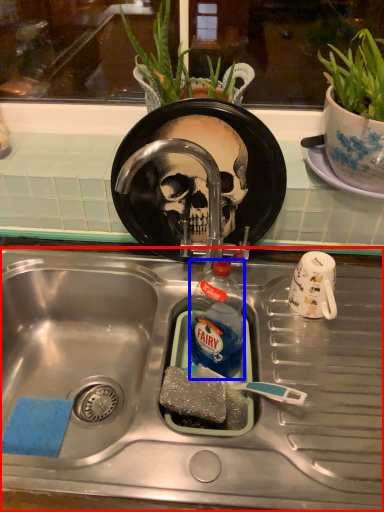
Question: Which object is closer to the camera taking this photo, sink (highlighted by a red box) or bottle (highlighted by a blue box)?

Choices:
 (A) sink
 (B) bottle

Answer: (A)